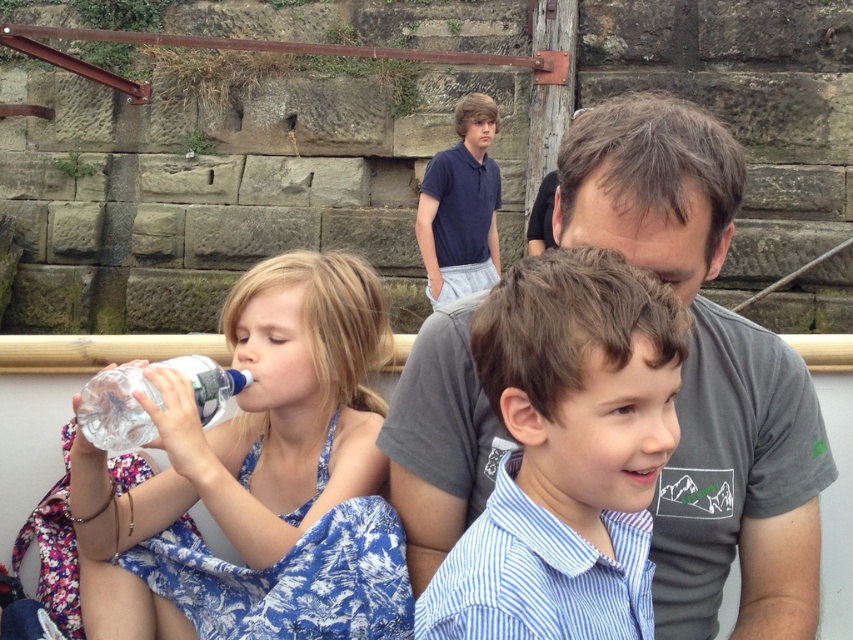
You are a photographer trying to capture a candid shot of the group. You notice the transparent plastic bottle at left and the navy blue polo shirt at upper center. Which object should you adjust your focus to ensure it appears larger in the photo?

Since the transparent plastic bottle at left occupies less space than the navy blue polo shirt at upper center, you should focus on the navy blue polo shirt at upper center to make it appear larger in the photo.